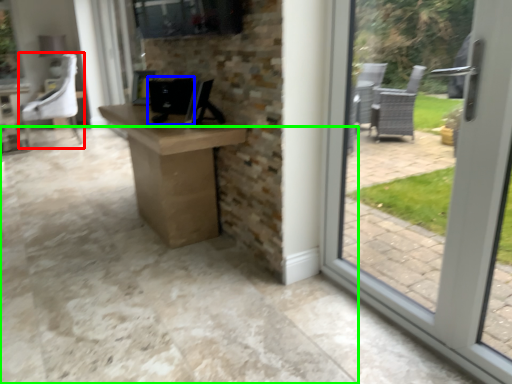
Question: Which object is positioned closest to chair (highlighted by a red box)? Select from desktop computer (highlighted by a blue box) and concrete (highlighted by a green box).

Choices:
 (A) desktop computer
 (B) concrete

Answer: (B)